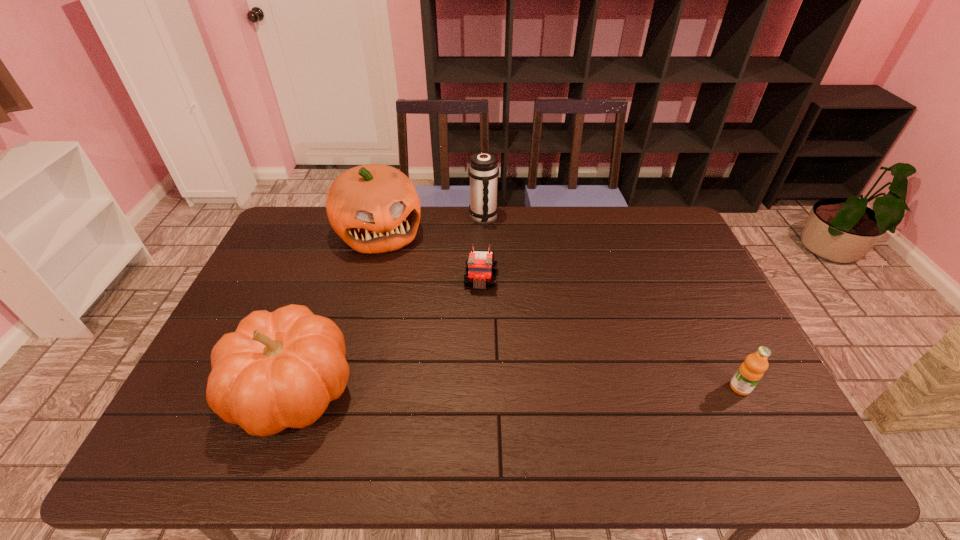
Where is `free space located 0.060m on the front-facing side of the third nearest object`? free space located 0.060m on the front-facing side of the third nearest object is located at coordinates (479, 308).

Locate an element on the screen. This screenshot has width=960, height=540. free space located on the face of the farther pumpkin is located at coordinates (404, 284).

Locate an element on the screen. vacant space situated 0.210m on the face of the farther pumpkin is located at coordinates (411, 299).

Find the location of a particular element. This screenshot has width=960, height=540. blank area located 0.120m on the face of the farther pumpkin is located at coordinates (402, 280).

You are a GUI agent. You are given a task and a screenshot of the screen. Output one action in this format:
    pyautogui.click(x=<x>, y=<y>)
    Task: Click on the vacant region located on the side with the handle of the thermos bottle
    
    Given the screenshot: What is the action you would take?
    pyautogui.click(x=521, y=292)

Find the location of a particular element. Image resolution: width=960 pixels, height=540 pixels. vacant space situated 0.100m on the side with the handle of the thermos bottle is located at coordinates (496, 245).

Where is `free space located 0.100m on the side with the handle of the thermos bottle`? free space located 0.100m on the side with the handle of the thermos bottle is located at coordinates (496, 245).

Identify the location of pumpkin present at the far edge. Image resolution: width=960 pixels, height=540 pixels. [374, 208].

The image size is (960, 540). Identify the location of thermos bottle that is at the far edge. (483, 171).

Where is `pumpkin present at the near edge`? Image resolution: width=960 pixels, height=540 pixels. pumpkin present at the near edge is located at coordinates (280, 369).